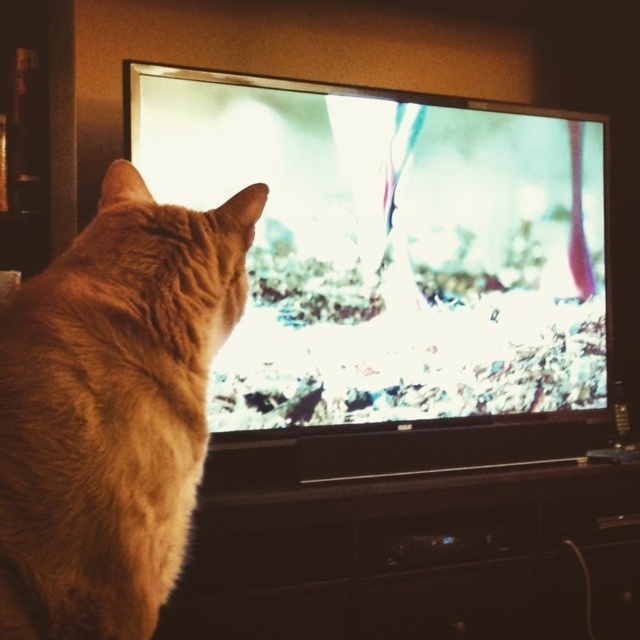
Question: Based on their relative distances, which object is nearer to the black plastic entertainment center at lower center?

Choices:
 (A) matte screen at center
 (B) orange fur cat at left

Answer: (A)

Question: Among these points, which one is farthest from the camera?

Choices:
 (A) [84, 586]
 (B) [493, 456]
 (C) [529, 474]

Answer: (B)

Question: Does matte screen at center appear on the left side of orange fur cat at left?

Choices:
 (A) yes
 (B) no

Answer: (B)

Question: Does orange fur cat at left appear on the right side of black plastic entertainment center at lower center?

Choices:
 (A) no
 (B) yes

Answer: (A)

Question: Which of the following is the farthest from the observer?

Choices:
 (A) orange fur cat at left
 (B) matte screen at center

Answer: (B)

Question: Does matte screen at center have a larger size compared to black plastic entertainment center at lower center?

Choices:
 (A) no
 (B) yes

Answer: (B)